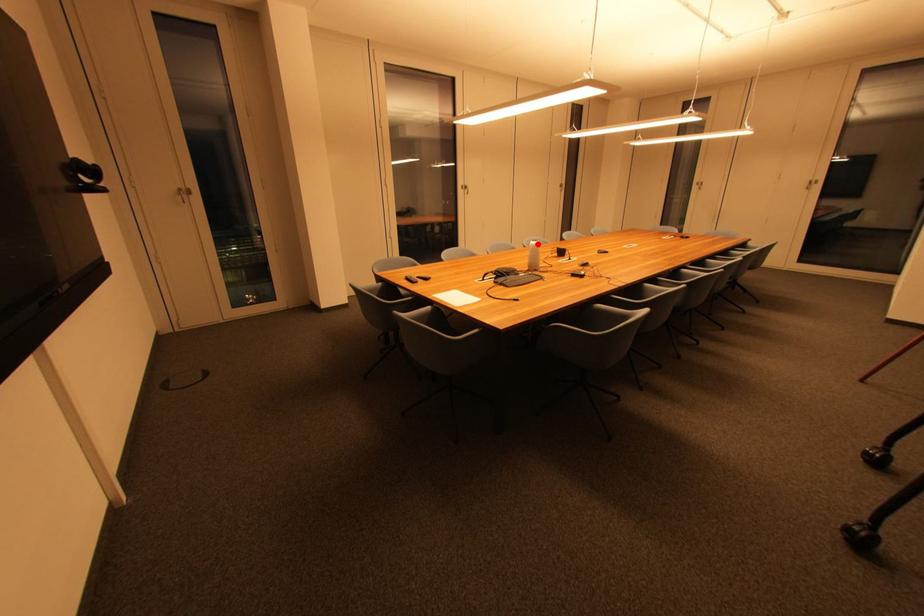
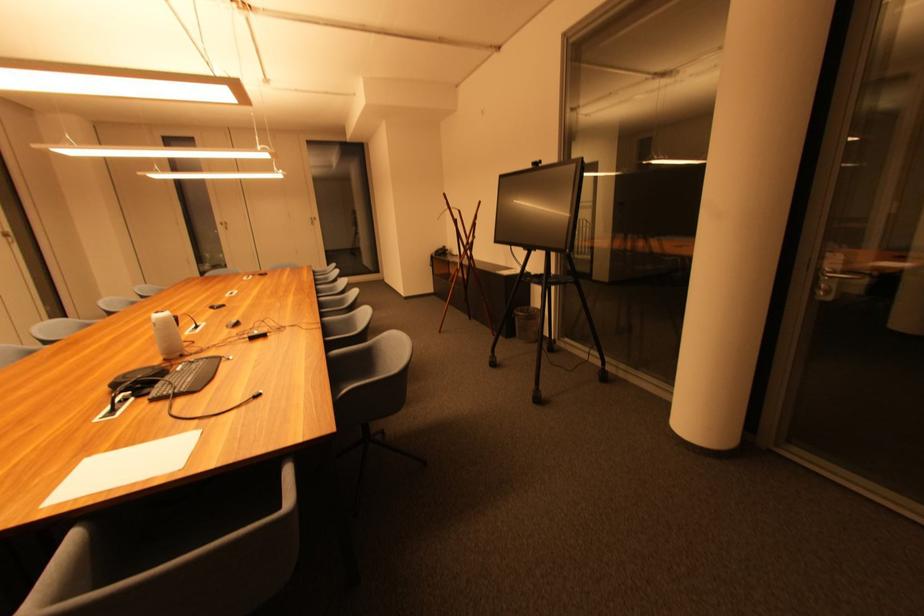
Locate, in the second image, the point that corresponds to the highlighted location in the first image.

(160, 318)